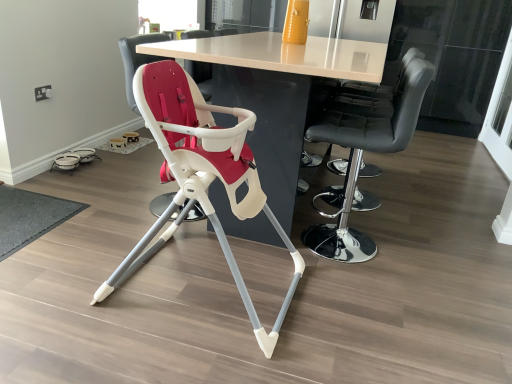
Question: Does point (151, 44) appear closer or farther from the camera than point (503, 134)?

Choices:
 (A) farther
 (B) closer

Answer: (B)

Question: From their relative heights in the image, would you say white glossy table at center is taller or shorter than transparent glass screen door at upper right?

Choices:
 (A) tall
 (B) short

Answer: (B)

Question: Considering the real-world distances, which object is farthest from the white plastic highchair at center, the 1th chair when ordered from left to right?

Choices:
 (A) matte plastic highchair at center, positioned as the 2th chair in right-to-left order
 (B) white glossy table at center
 (C) black leather bar stool at right, marked as the third chair in a left-to-right arrangement
 (D) transparent glass screen door at upper right

Answer: (D)

Question: Which is farther from the transparent glass screen door at upper right?

Choices:
 (A) white plastic highchair at center, arranged as the 3th chair when viewed from the right
 (B) white glossy table at center
 (C) black leather bar stool at right, marked as the third chair in a left-to-right arrangement
 (D) matte plastic highchair at center, the second chair viewed from the left

Answer: (A)